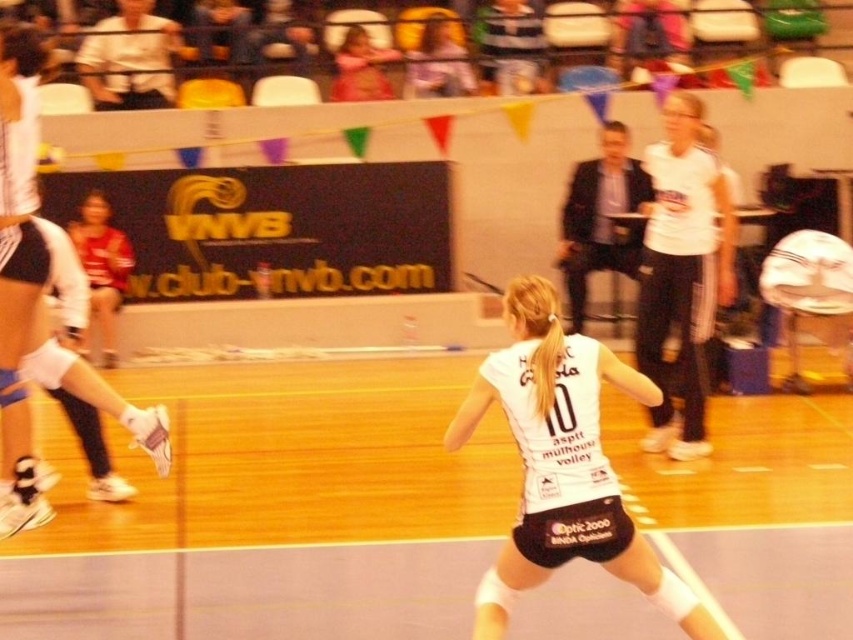
Question: In this image, where is white matte shorts at lower left located relative to pink fabric at upper center?

Choices:
 (A) left
 (B) right

Answer: (A)

Question: Does white jersey at center appear under matte white jersey at center?

Choices:
 (A) yes
 (B) no

Answer: (A)

Question: Which point appears farthest from the camera in this image?

Choices:
 (A) (573, 536)
 (B) (3, 465)
 (C) (383, 58)

Answer: (C)

Question: Is matte white jersey at center thinner than pink fabric at upper center?

Choices:
 (A) yes
 (B) no

Answer: (B)

Question: Which of these objects is positioned closest to the white jersey at center?

Choices:
 (A) matte white jersey at center
 (B) white matte shorts at lower left
 (C) pink fabric at upper center

Answer: (B)

Question: Which object appears closest to the camera in this image?

Choices:
 (A) pink fabric at upper center
 (B) white matte shorts at lower left
 (C) white jersey at center

Answer: (C)